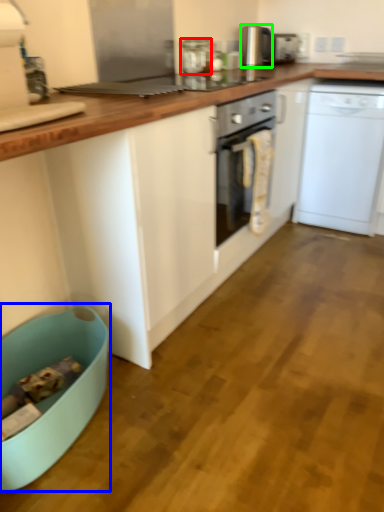
Question: Estimate the real-world distances between objects in this image. Which object is closer to kitchen appliance (highlighted by a red box), dish washer (highlighted by a blue box) or kitchen appliance (highlighted by a green box)?

Choices:
 (A) dish washer
 (B) kitchen appliance

Answer: (B)